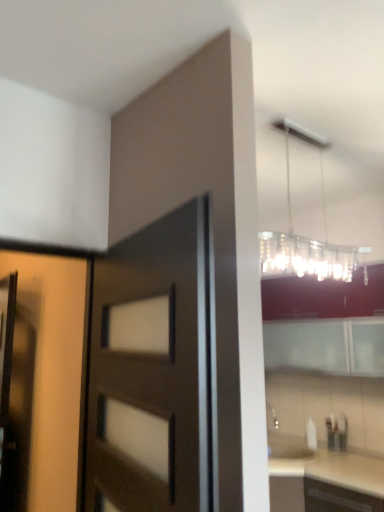
Question: Is matte brown screen door at left bigger than clear glass chandelier at upper right?

Choices:
 (A) no
 (B) yes

Answer: (A)

Question: Does matte brown screen door at left appear on the left side of clear glass chandelier at upper right?

Choices:
 (A) no
 (B) yes

Answer: (B)

Question: Can you confirm if matte brown screen door at left is positioned to the right of clear glass chandelier at upper right?

Choices:
 (A) yes
 (B) no

Answer: (B)

Question: Considering the relative sizes of matte brown screen door at left and clear glass chandelier at upper right in the image provided, is matte brown screen door at left wider than clear glass chandelier at upper right?

Choices:
 (A) yes
 (B) no

Answer: (B)

Question: Is matte brown screen door at left positioned in front of clear glass chandelier at upper right?

Choices:
 (A) yes
 (B) no

Answer: (B)

Question: Is matte brown screen door at left far away from clear glass chandelier at upper right?

Choices:
 (A) no
 (B) yes

Answer: (B)

Question: Is matte brown door at center, which ranks as the 2th door in left-to-right order, placed right next to clear glass chandelier at upper right?

Choices:
 (A) yes
 (B) no

Answer: (B)

Question: Does matte brown door at center, which ranks as the 2th door in left-to-right order, appear on the right side of clear glass chandelier at upper right?

Choices:
 (A) yes
 (B) no

Answer: (B)

Question: Is clear glass chandelier at upper right a part of matte brown door at center, which ranks as the 2th door in left-to-right order?

Choices:
 (A) yes
 (B) no

Answer: (B)

Question: Is matte brown door at center, marked as the first door in a right-to-left arrangement, looking in the opposite direction of clear glass chandelier at upper right?

Choices:
 (A) no
 (B) yes

Answer: (B)

Question: Is matte brown door at center, which ranks as the 2th door in left-to-right order, far away from clear glass chandelier at upper right?

Choices:
 (A) yes
 (B) no

Answer: (B)

Question: Considering the relative positions of matte brown door at center, marked as the first door in a right-to-left arrangement, and clear glass chandelier at upper right in the image provided, is matte brown door at center, marked as the first door in a right-to-left arrangement, to the left of clear glass chandelier at upper right from the viewer's perspective?

Choices:
 (A) no
 (B) yes

Answer: (B)

Question: Is matte wood door at left, placed as the 1th door when sorted from left to right, facing towards matte brown screen door at left?

Choices:
 (A) yes
 (B) no

Answer: (B)